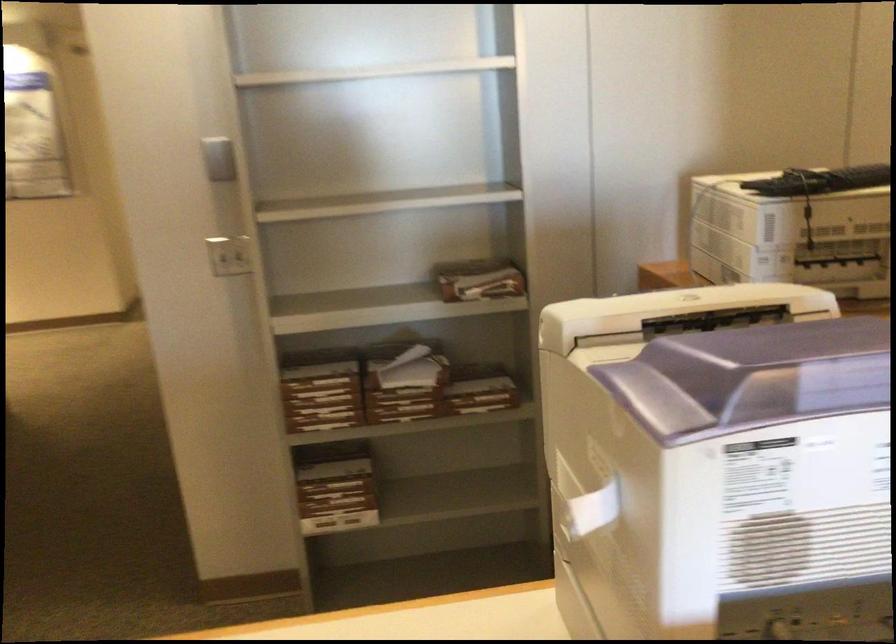
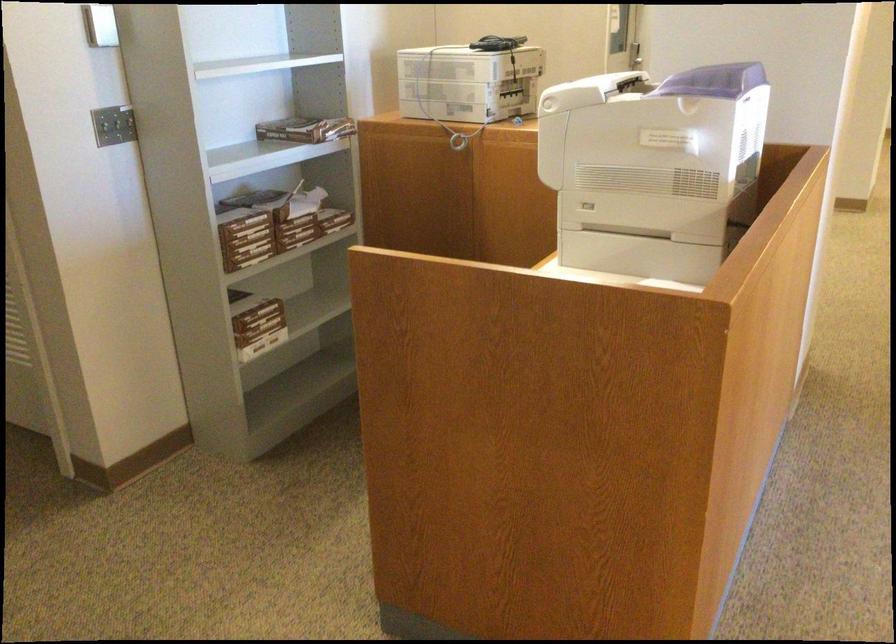
Where in the second image is the point corresponding to (x=319, y=498) from the first image?

(257, 321)